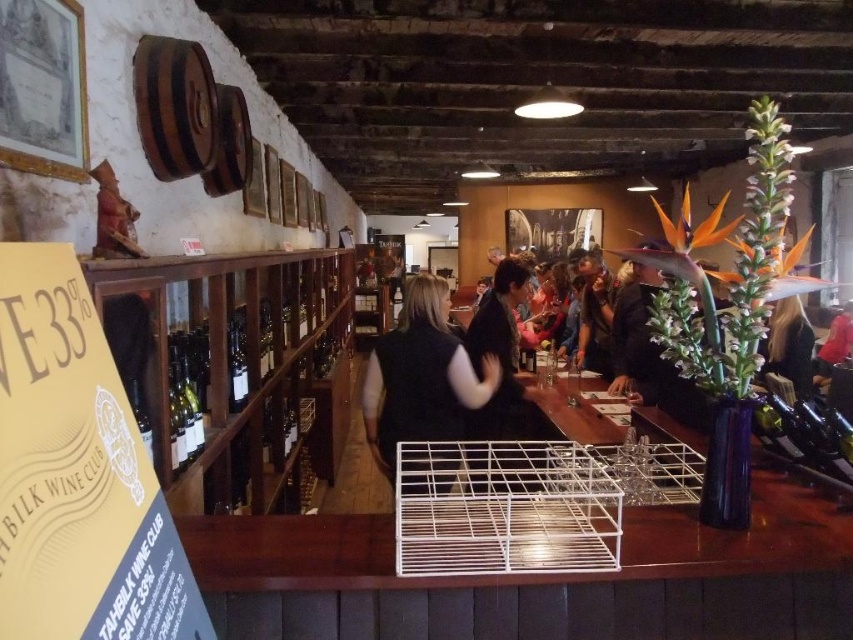
From the picture: Can you confirm if blonde hair at center is positioned to the left of translucent glass bottle at center?

In fact, blonde hair at center is to the right of translucent glass bottle at center.

Is blonde hair at center to the right of translucent glass bottle at center from the viewer's perspective?

Yes, blonde hair at center is to the right of translucent glass bottle at center.

Who is more forward, (759, 378) or (242, 388)?

Point (242, 388) is more forward.

In order to click on blonde hair at center in this screenshot , I will do `click(788, 346)`.

Who is more forward, (462, 458) or (264, 346)?

Point (462, 458) is in front.

Can you confirm if white wire cage at center is positioned to the right of green glass bottle at center?

Indeed, white wire cage at center is positioned on the right side of green glass bottle at center.

This screenshot has width=853, height=640. In order to click on white wire cage at center in this screenshot , I will do `click(503, 508)`.

At what (x,y) coordinates should I click in order to perform the action: click on white wire cage at center. Please return your answer as a coordinate pair (x, y). This screenshot has width=853, height=640. Looking at the image, I should click on (503, 508).

Can you confirm if matte black jacket at center is thinner than green glass bottle at center?

Incorrect, matte black jacket at center's width is not less than green glass bottle at center's.

Between matte black jacket at center and green glass bottle at center, which one has more height?

matte black jacket at center is taller.

Between point (606, 372) and point (264, 323), which one is positioned in front?

Point (264, 323) is in front.

The image size is (853, 640). Identify the location of matte black jacket at center. (595, 316).